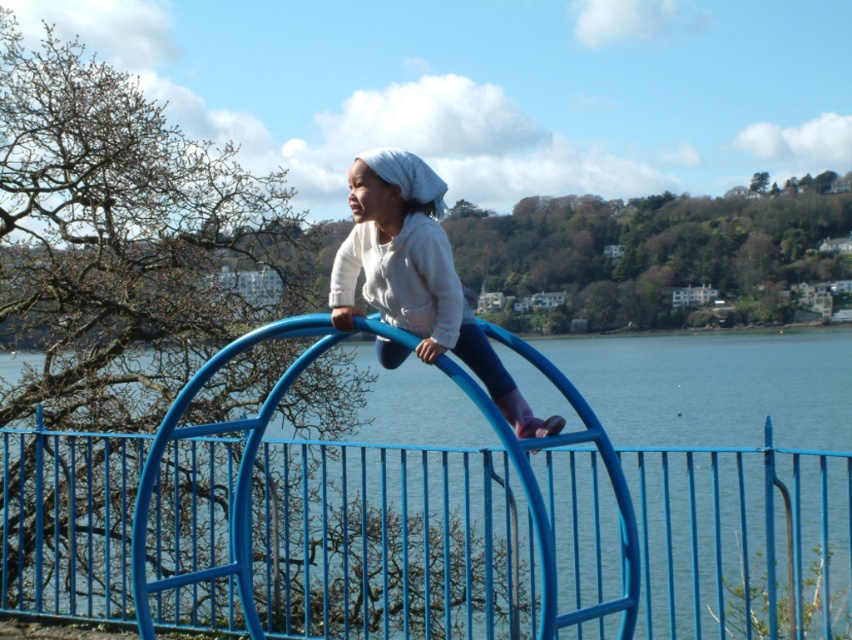
You are a parent supervising your child at the playground. You notice the blue metal fence at center and the matte white hoodie at center. Which object is wider from your viewpoint?

The blue metal fence at center is wider than the matte white hoodie at center from your viewpoint.

You are a parent supervising your child at the playground. You see the blue metal fence at center and the matte white hoodie at center. Which object is located to the left of the other?

The blue metal fence at center is positioned on the left side of matte white hoodie at center.

You are a parent supervising your child at the playground. You notice the blue metal fence at center and the matte white hoodie at center. Which object is taller?

The blue metal fence at center is taller than the matte white hoodie at center.